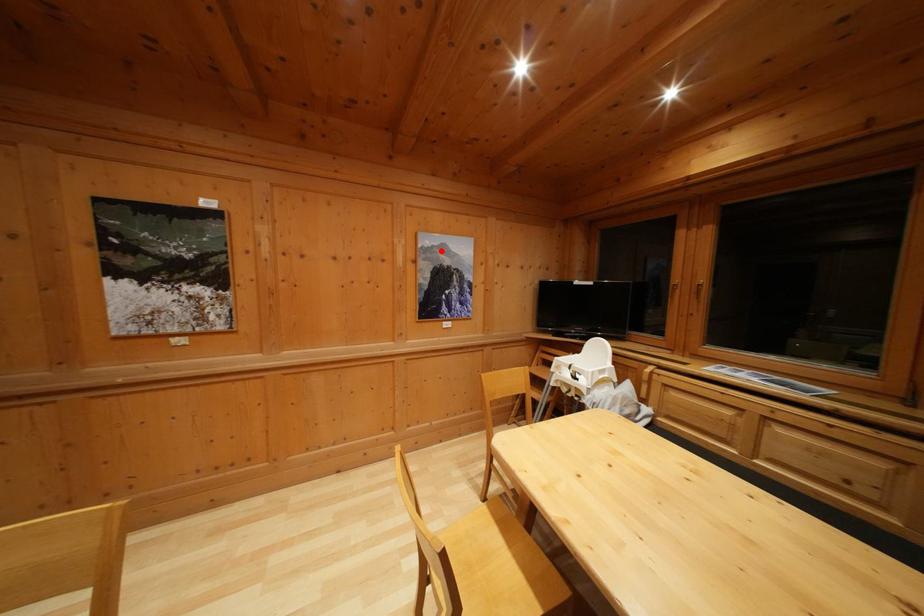
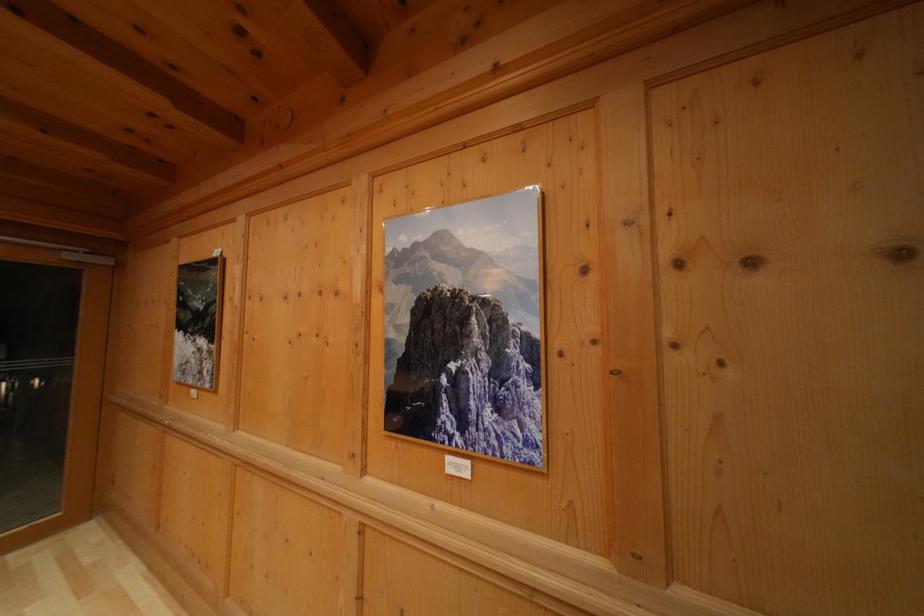
In the second image, find the point that corresponds to the highlighted location in the first image.

(427, 245)